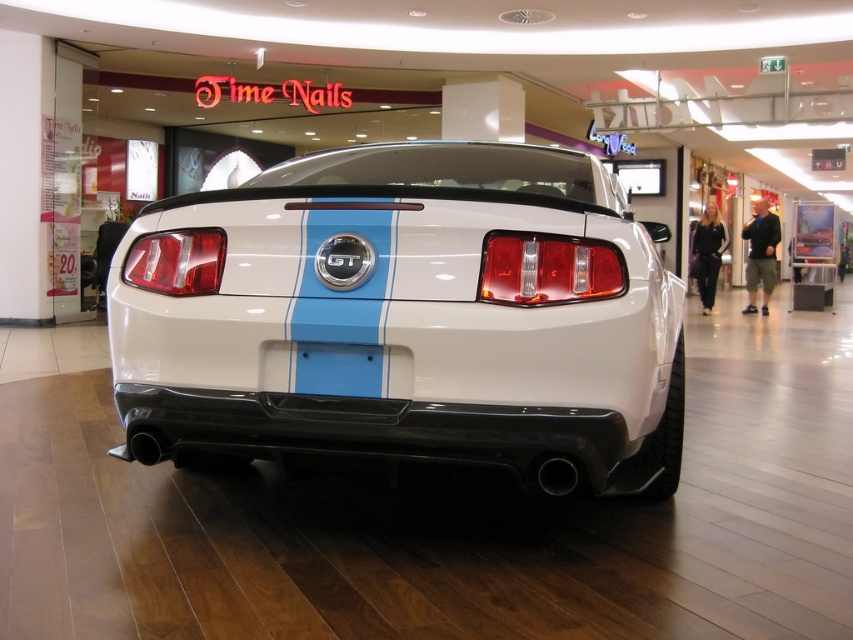
You are a photographer standing in front of the white glossy car at center. You want to take a photo of it but need to ensure you are within the recommended 8 feet distance for optimal clarity. Is your current position within the safe distance?

The white glossy car at center is 6.67 feet away from camera, which is within the recommended 8 feet distance for optimal clarity. You can take the photo from your current position.

In the scene shown: You are a delivery person with a cart that is 1.8 meters wide. You need to navigate around the white glossy car at center in the mall parking area. Can your cart fit through the space between the car and the nearest wall? Please explain.

Result: The distance between the white glossy car at center and the camera is 2.03 meters. Since the cart is 1.8 meters wide, it should fit as long as the space between the car and the wall is at least 1.8 meters. However, the description does not provide information about the distance to the nearest wall, so we cannot confirm if there is enough space.

You are a parking assistant trying to align a new car with the existing vehicles in the mall parking area. You notice the white glossy car at center and the translucent red tail light at center. Which object is located more to the left?

The white glossy car at center is positioned on the left side of the translucent red tail light at center, so it is more to the left.